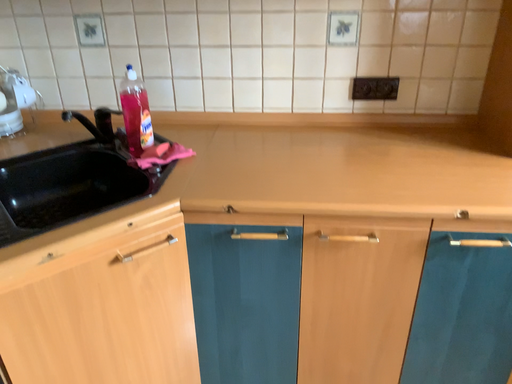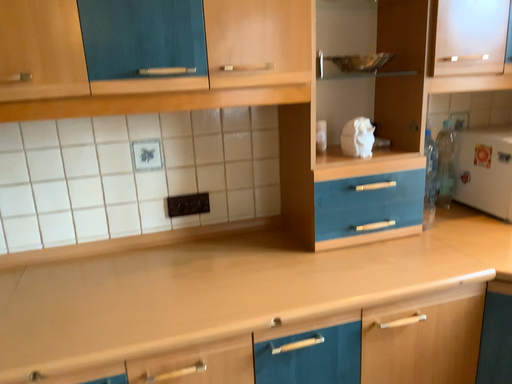
Question: How did the camera likely rotate when shooting the video?

Choices:
 (A) rotated left
 (B) rotated right

Answer: (B)